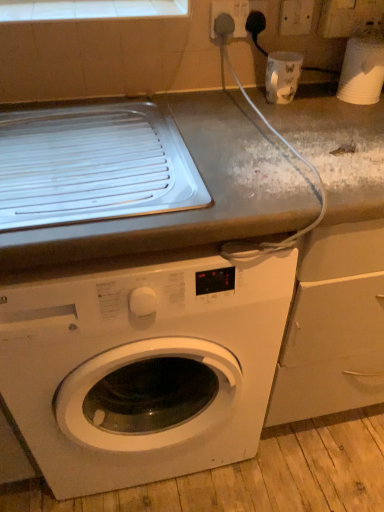
The width and height of the screenshot is (384, 512). I want to click on free space in front of white glossy cup at upper right, acting as the first appliance starting from the left, so click(296, 126).